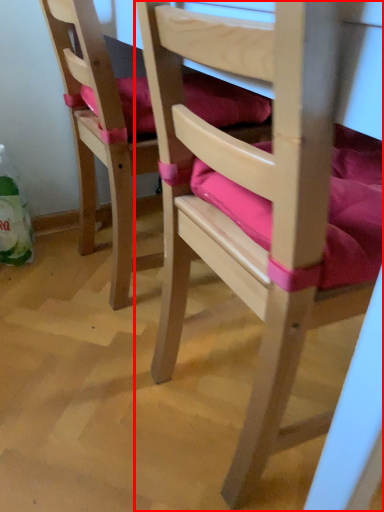
Question: From the image's perspective, where is chair (annotated by the red box) located in relation to chair in the image?

Choices:
 (A) above
 (B) below

Answer: (B)